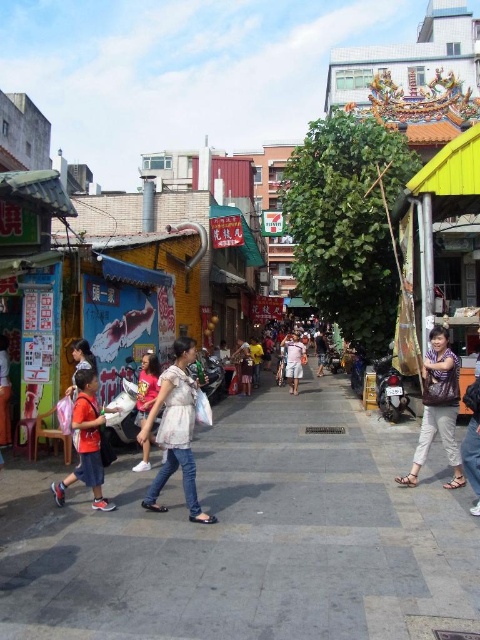
Can you confirm if gray concrete pavement at center is positioned above pink cotton shirt at center?

No.

Does gray concrete pavement at center appear on the right side of pink cotton shirt at center?

Yes, gray concrete pavement at center is to the right of pink cotton shirt at center.

Which is in front, point (197, 586) or point (143, 387)?

Point (197, 586)

Locate an element on the screen. gray concrete pavement at center is located at coordinates (259, 540).

Is point (351, 448) more distant than point (289, 378)?

No.

Who is higher up, gray concrete pavement at center or white cotton shorts at center?

white cotton shorts at center is higher up.

Which is in front, point (126, 614) or point (292, 365)?

Point (126, 614) is more forward.

At what (x,y) coordinates should I click in order to perform the action: click on gray concrete pavement at center. Please return your answer as a coordinate pair (x, y). This screenshot has width=480, height=640. Looking at the image, I should click on (259, 540).

At what (x,y) coordinates should I click in order to perform the action: click on white cotton shorts at center. Please return your answer as a coordinate pair (x, y). The height and width of the screenshot is (640, 480). Looking at the image, I should click on (294, 360).

Is point (291, 372) positioned after point (322, 330)?

No, (291, 372) is closer to viewer.

Identify the location of white cotton shorts at center. This screenshot has width=480, height=640. (294, 360).

This screenshot has width=480, height=640. What are the coordinates of `white cotton shorts at center` in the screenshot? It's located at (294, 360).